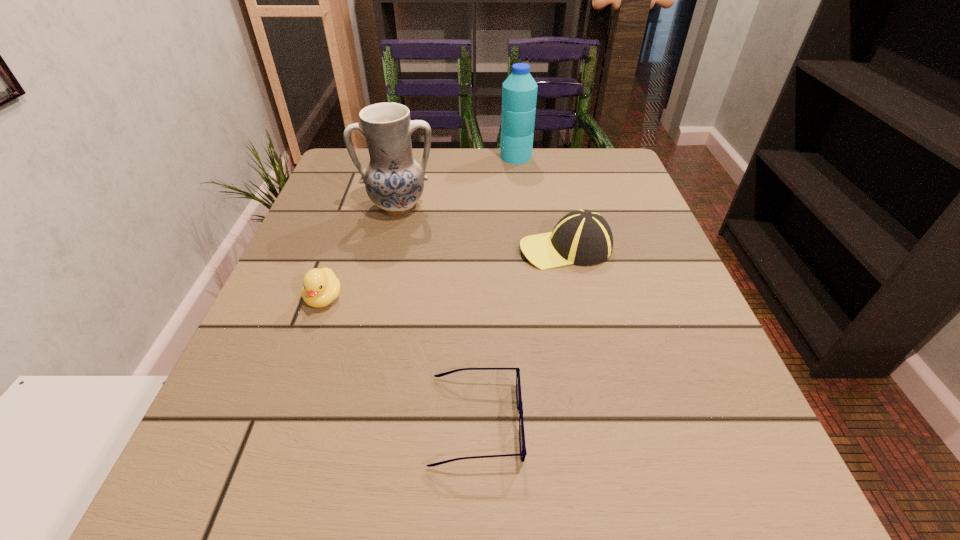
Find the location of a particular element. Image resolution: width=960 pixels, height=540 pixels. vacant space that's between the nearest object and the second farthest object is located at coordinates (438, 314).

At what (x,y) coordinates should I click in order to perform the action: click on blank region between the second nearest object and the baseball cap. Please return your answer as a coordinate pair (x, y). Image resolution: width=960 pixels, height=540 pixels. Looking at the image, I should click on (444, 273).

The image size is (960, 540). In order to click on empty location between the farthest object and the third farthest object in this screenshot , I will do `click(540, 202)`.

I want to click on empty space that is in between the baseball cap and the duckling, so click(x=444, y=273).

Where is `vacant space that is in between the spectacles and the water bottle`? Image resolution: width=960 pixels, height=540 pixels. vacant space that is in between the spectacles and the water bottle is located at coordinates (496, 289).

This screenshot has height=540, width=960. What are the coordinates of `vacant region between the shortest object and the duckling` in the screenshot? It's located at (400, 360).

Where is `empty space that is in between the second nearest object and the second farthest object`? The width and height of the screenshot is (960, 540). empty space that is in between the second nearest object and the second farthest object is located at coordinates (362, 252).

Where is `object that ranks as the closest to the farthest object`? The height and width of the screenshot is (540, 960). object that ranks as the closest to the farthest object is located at coordinates (394, 181).

Find the location of a particular element. The image size is (960, 540). object that stands as the closest to the farthest object is located at coordinates [394, 181].

Locate an element on the screen. Image resolution: width=960 pixels, height=540 pixels. free space that satisfies the following two spatial constraints: 1. with the brim of the third nearest object facing forward; 2. on the beak of the duckling is located at coordinates (577, 298).